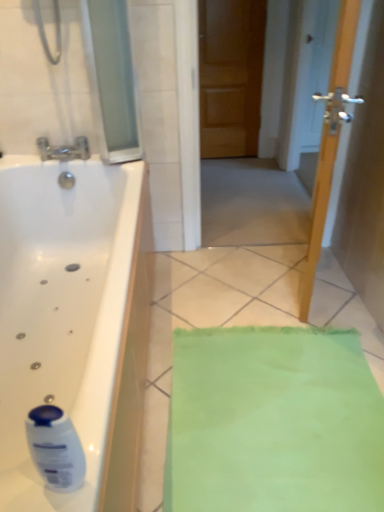
Question: From a real-world perspective, is wooden door at center positioned over transparent glass door at upper left based on gravity?

Choices:
 (A) no
 (B) yes

Answer: (A)

Question: From a real-world perspective, is wooden door at center located beneath transparent glass door at upper left?

Choices:
 (A) no
 (B) yes

Answer: (B)

Question: From the image's perspective, does wooden door at center appear higher than transparent glass door at upper left?

Choices:
 (A) no
 (B) yes

Answer: (B)

Question: Can you confirm if wooden door at center is wider than transparent glass door at upper left?

Choices:
 (A) no
 (B) yes

Answer: (A)

Question: Is wooden door at center shorter than transparent glass door at upper left?

Choices:
 (A) yes
 (B) no

Answer: (B)

Question: Can you confirm if wooden door at center is bigger than transparent glass door at upper left?

Choices:
 (A) yes
 (B) no

Answer: (A)

Question: Is silver metallic faucet at upper left next to wooden door at center?

Choices:
 (A) yes
 (B) no

Answer: (B)

Question: Is silver metallic faucet at upper left further to camera compared to wooden door at center?

Choices:
 (A) no
 (B) yes

Answer: (B)

Question: Is silver metallic faucet at upper left positioned in front of wooden door at center?

Choices:
 (A) yes
 (B) no

Answer: (B)

Question: Does silver metallic faucet at upper left appear on the left side of wooden door at center?

Choices:
 (A) yes
 (B) no

Answer: (A)

Question: Is silver metallic faucet at upper left oriented towards wooden door at center?

Choices:
 (A) no
 (B) yes

Answer: (A)

Question: From a real-world perspective, is silver metallic faucet at upper left positioned under wooden door at center based on gravity?

Choices:
 (A) yes
 (B) no

Answer: (B)

Question: From the image's perspective, is wooden door at center beneath silver metallic faucet at upper left?

Choices:
 (A) no
 (B) yes

Answer: (A)